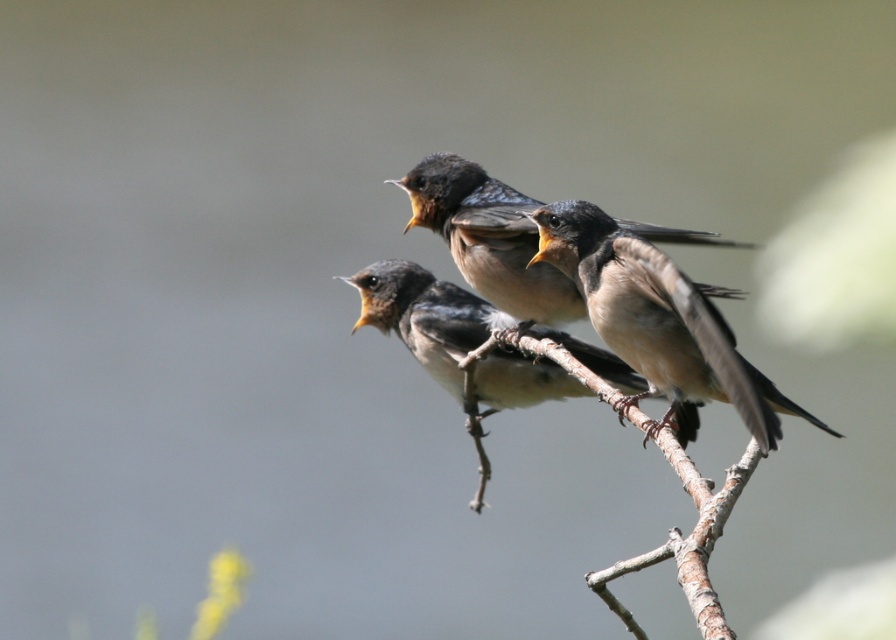
You are observing three young barn swallows on a branch. You notice a brown feathered bird at center. Can you determine its exact position on the branch based on the coordinates provided?

The brown feathered bird at center is located at point (658, 323), which means it is positioned precisely at those coordinates on the branch.

You are a birdwatcher trying to identify the exact location of the brown matte bird at center in an image. The image has a coordinate system where the bottom left corner is the origin point. Can you determine whether the brown matte bird at center is located to the left or right of the point with coordinates point (x=425, y=316)?

The point (x=425, y=316) marks the brown matte bird at center, so it is exactly at that coordinate. Therefore, the brown matte bird at center is neither to the left nor right of the point (x=425, y=316).

You are a birdwatcher observing the scene. You notice the brown feathered birds at center and the brown rough tree branch at center. Which object is shorter?

The brown feathered birds at center is shorter than the brown rough tree branch at center.